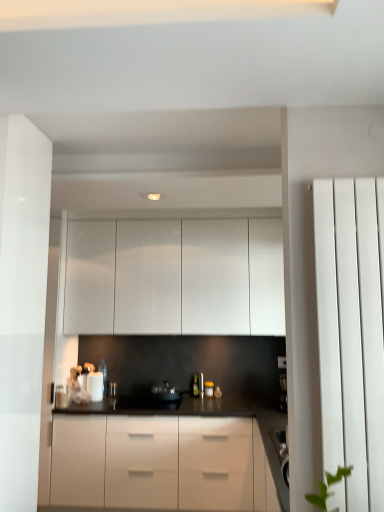
Question: Can you confirm if white glossy cabinets at upper center is shorter than black plastic coffee machine at right?

Choices:
 (A) yes
 (B) no

Answer: (B)

Question: Considering the relative sizes of white glossy cabinets at upper center and black plastic coffee machine at right in the image provided, is white glossy cabinets at upper center thinner than black plastic coffee machine at right?

Choices:
 (A) no
 (B) yes

Answer: (A)

Question: Is white glossy cabinets at upper center at the left side of black plastic coffee machine at right?

Choices:
 (A) no
 (B) yes

Answer: (B)

Question: Can you confirm if white glossy cabinets at upper center is bigger than black plastic coffee machine at right?

Choices:
 (A) no
 (B) yes

Answer: (B)

Question: Is there a large distance between white glossy cabinets at upper center and black plastic coffee machine at right?

Choices:
 (A) yes
 (B) no

Answer: (A)

Question: Could you tell me if white glossy cabinets at upper center is turned towards black plastic coffee machine at right?

Choices:
 (A) no
 (B) yes

Answer: (A)

Question: From the image's perspective, is white smooth radiator at right above black glossy kettle at center?

Choices:
 (A) yes
 (B) no

Answer: (A)

Question: Does white smooth radiator at right come in front of black glossy kettle at center?

Choices:
 (A) yes
 (B) no

Answer: (A)

Question: From a real-world perspective, is white smooth radiator at right on top of black glossy kettle at center?

Choices:
 (A) no
 (B) yes

Answer: (B)

Question: Does white smooth radiator at right have a lesser height compared to black glossy kettle at center?

Choices:
 (A) no
 (B) yes

Answer: (A)

Question: Could you tell me if white smooth radiator at right is facing black glossy kettle at center?

Choices:
 (A) no
 (B) yes

Answer: (A)

Question: Is white smooth radiator at right taller than black glossy kettle at center?

Choices:
 (A) yes
 (B) no

Answer: (A)

Question: Can you confirm if white smooth radiator at right is taller than white glossy cabinets at upper center?

Choices:
 (A) yes
 (B) no

Answer: (B)